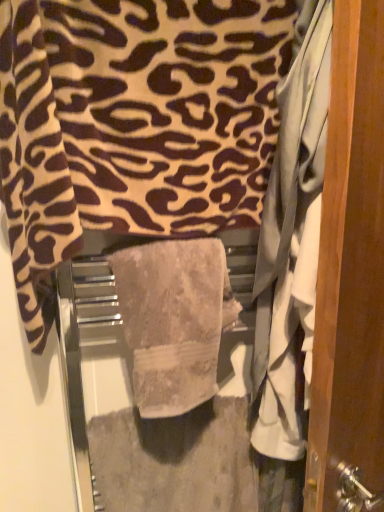
Question: Is beige textured towel at center, which is counted as the first towel, starting from the bottom, located within beige textured towel at center, which appears as the second towel when ordered from the bottom?

Choices:
 (A) yes
 (B) no

Answer: (A)

Question: Considering the relative sizes of beige textured towel at center, which appears as the second towel when ordered from the bottom, and beige textured towel at center, which is counted as the first towel, starting from the bottom, in the image provided, is beige textured towel at center, which appears as the second towel when ordered from the bottom, thinner than beige textured towel at center, which is counted as the first towel, starting from the bottom,?

Choices:
 (A) yes
 (B) no

Answer: (B)

Question: Is beige textured towel at center, which appears as the second towel when ordered from the bottom, facing away from beige textured towel at center, acting as the 2th towel starting from the top?

Choices:
 (A) no
 (B) yes

Answer: (A)

Question: From a real-world perspective, is beige textured towel at center, which appears as the second towel when ordered from the bottom, positioned under beige textured towel at center, acting as the 2th towel starting from the top, based on gravity?

Choices:
 (A) no
 (B) yes

Answer: (A)

Question: Are beige textured towel at center, arranged as the 1th towel when viewed from the top, and beige textured towel at center, acting as the 2th towel starting from the top, far apart?

Choices:
 (A) yes
 (B) no

Answer: (B)

Question: Is wooden door at right in front of or behind beige textured towel at center, acting as the 2th towel starting from the top, in the image?

Choices:
 (A) behind
 (B) front

Answer: (B)

Question: In the image, is wooden door at right on the left side or the right side of beige textured towel at center, acting as the 2th towel starting from the top?

Choices:
 (A) right
 (B) left

Answer: (A)

Question: Looking at their shapes, would you say wooden door at right is wider or thinner than beige textured towel at center, acting as the 2th towel starting from the top?

Choices:
 (A) wide
 (B) thin

Answer: (B)

Question: From the image's perspective, is wooden door at right positioned above or below beige textured towel at center, acting as the 2th towel starting from the top?

Choices:
 (A) below
 (B) above

Answer: (B)

Question: From a real-world perspective, is beige textured towel at center, acting as the 2th towel starting from the top, above or below beige textured towel at center, which appears as the second towel when ordered from the bottom?

Choices:
 (A) above
 (B) below

Answer: (B)

Question: Considering the positions of beige textured towel at center, which is counted as the first towel, starting from the bottom, and beige textured towel at center, arranged as the 1th towel when viewed from the top, in the image, is beige textured towel at center, which is counted as the first towel, starting from the bottom, taller or shorter than beige textured towel at center, arranged as the 1th towel when viewed from the top,?

Choices:
 (A) short
 (B) tall

Answer: (A)

Question: From the image's perspective, is beige textured towel at center, which is counted as the first towel, starting from the bottom, located above or below beige textured towel at center, which appears as the second towel when ordered from the bottom?

Choices:
 (A) above
 (B) below

Answer: (B)

Question: Considering their positions, is beige textured towel at center, which is counted as the first towel, starting from the bottom, located in front of or behind beige textured towel at center, which appears as the second towel when ordered from the bottom?

Choices:
 (A) front
 (B) behind

Answer: (B)

Question: Considering the positions of beige textured towel at center, which is counted as the first towel, starting from the bottom, and wooden door at right in the image, is beige textured towel at center, which is counted as the first towel, starting from the bottom, taller or shorter than wooden door at right?

Choices:
 (A) short
 (B) tall

Answer: (A)

Question: From a real-world perspective, is beige textured towel at center, acting as the 2th towel starting from the top, positioned above or below wooden door at right?

Choices:
 (A) above
 (B) below

Answer: (B)